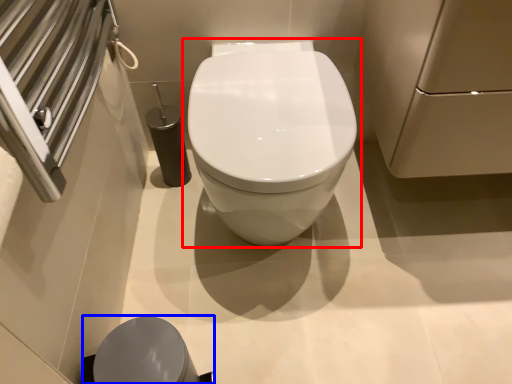
Question: Which point is closer to the camera, toilet (highlighted by a red box) or porcelain (highlighted by a blue box)?

Choices:
 (A) toilet
 (B) porcelain

Answer: (B)